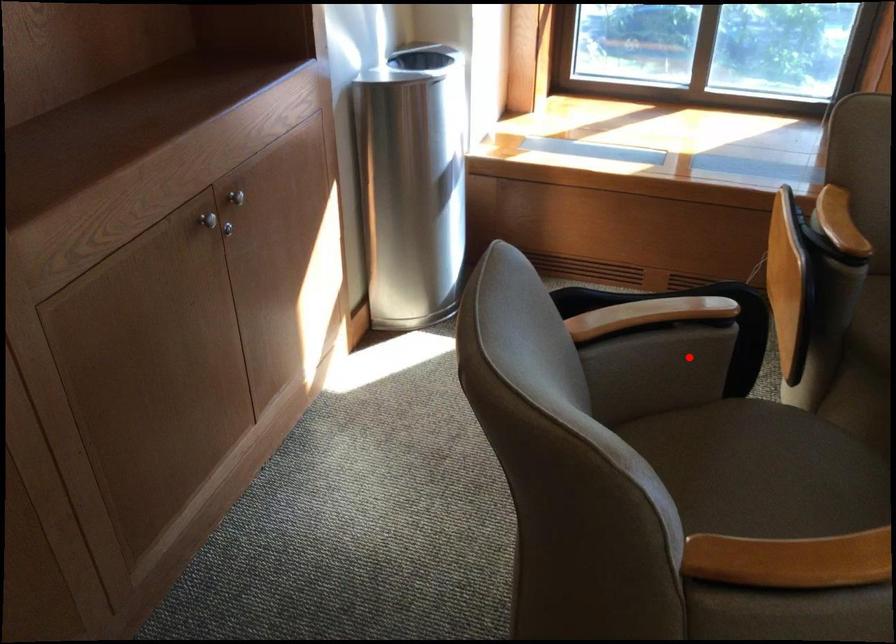
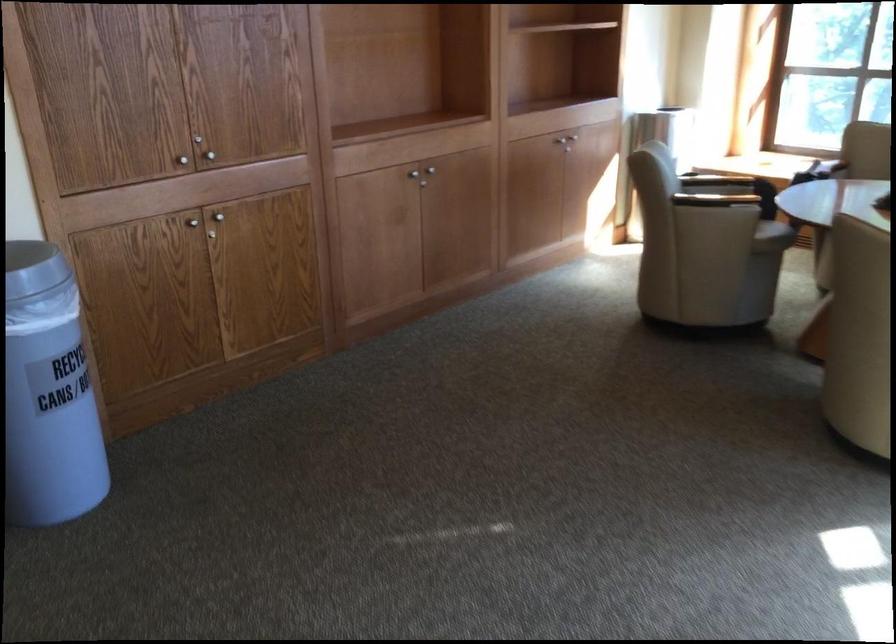
Question: I am providing you with two images of the same scene from different viewpoints. In image1, a red point is highlighted. Considering the same 3D point in image2, which of the following is correct?

Choices:
 (A) It is closer
 (B) It is farther

Answer: (B)